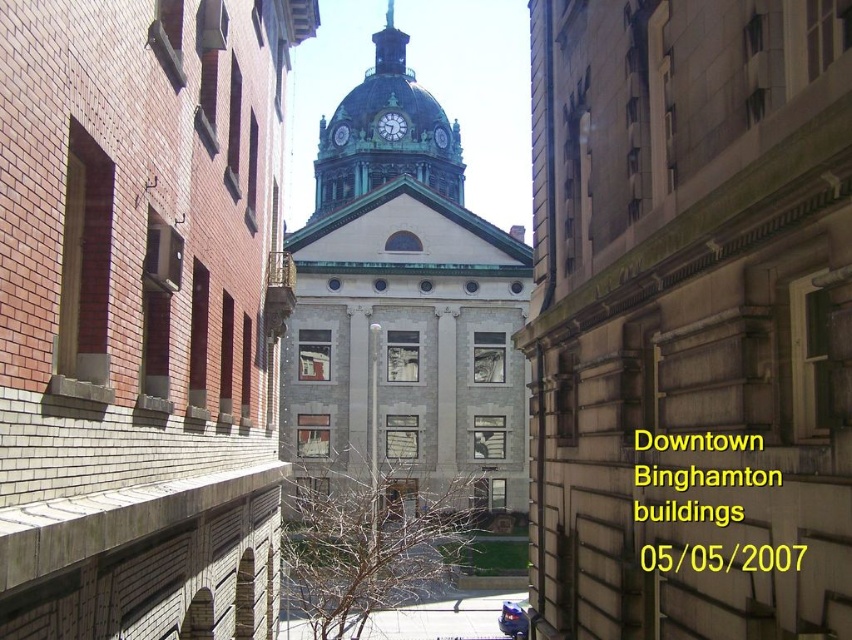
Does green glass clock at center have a lesser height compared to green metallic clock at center?

No.

Does green glass clock at center have a greater width compared to green metallic clock at center?

Indeed, green glass clock at center has a greater width compared to green metallic clock at center.

The width and height of the screenshot is (852, 640). Identify the location of green glass clock at center. (390, 125).

This screenshot has width=852, height=640. I want to click on green copper spire at center, so click(x=389, y=45).

Between green copper spire at center and green metallic clock at center, which one is positioned higher?

green copper spire at center is higher up.

Does point (386, 32) come behind point (445, 131)?

Yes, it is behind point (445, 131).

You are a GUI agent. You are given a task and a screenshot of the screen. Output one action in this format:
    pyautogui.click(x=<x>, y=<y>)
    Task: Click on the green copper spire at center
    This screenshot has width=852, height=640.
    Given the screenshot: What is the action you would take?
    pyautogui.click(x=389, y=45)

Does gray stone clock tower at center appear on the right side of green glass clock at center?

Correct, you'll find gray stone clock tower at center to the right of green glass clock at center.

Is gray stone clock tower at center shorter than green glass clock at center?

No.

Measure the distance between point (x=321, y=456) and camera.

83.80 meters

Where is `gray stone clock tower at center`? gray stone clock tower at center is located at coordinates (404, 310).